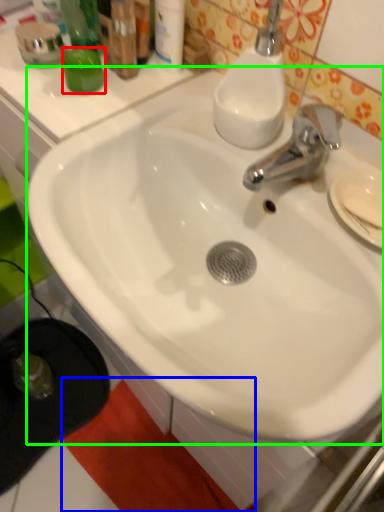
Question: Estimate the real-world distances between objects in this image. Which object is farther from liquid (highlighted by a red box), beach towel (highlighted by a blue box) or sink (highlighted by a green box)?

Choices:
 (A) beach towel
 (B) sink

Answer: (A)